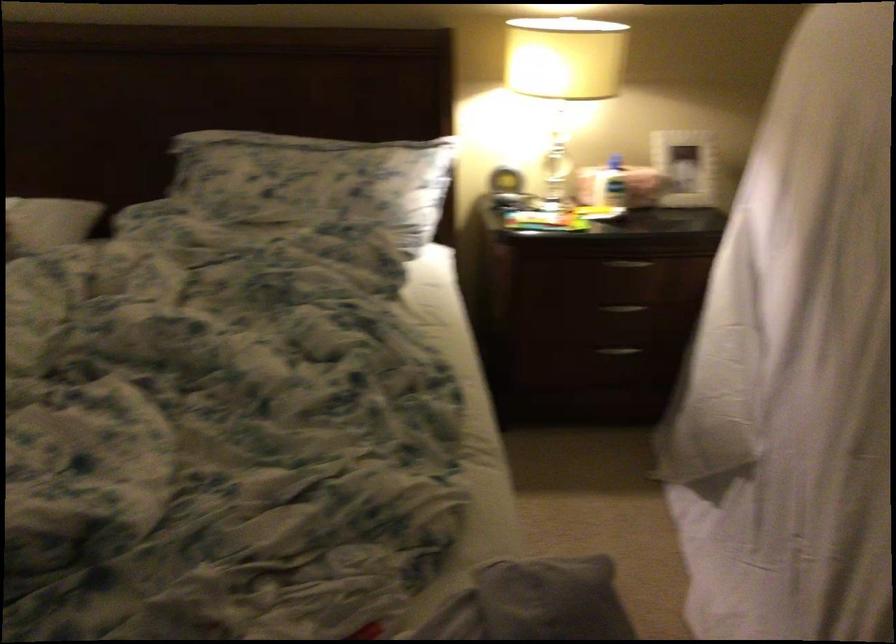
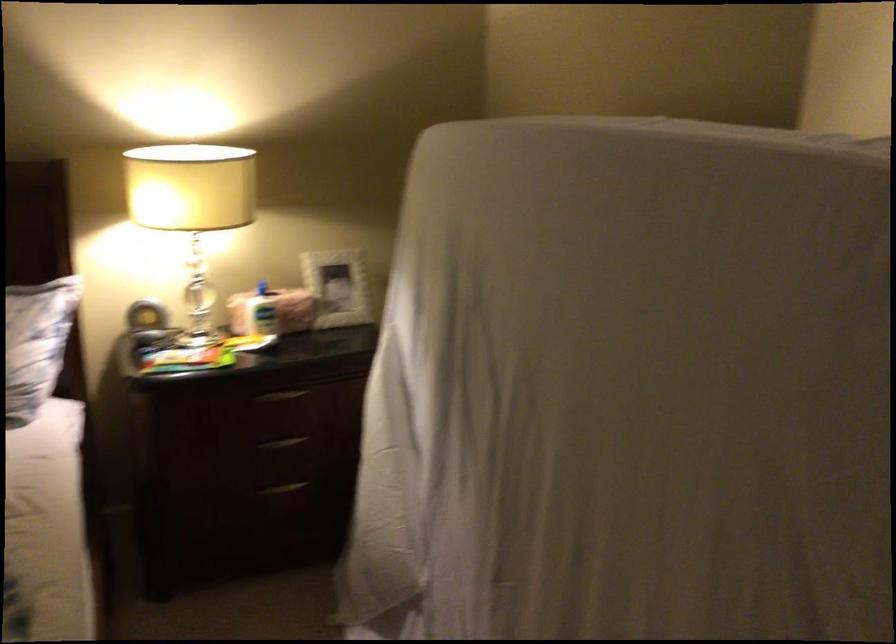
In the second image, find the point that corresponds to (x=624, y=304) in the first image.

(282, 442)